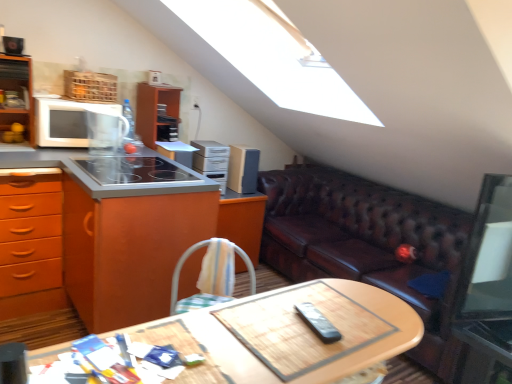
At what (x,y) coordinates should I click in order to perform the action: click on vacant location behind black plastic remote at center, acting as the 1th appliance starting from the right. Please return your answer as a coordinate pair (x, y). Looking at the image, I should click on (318, 301).